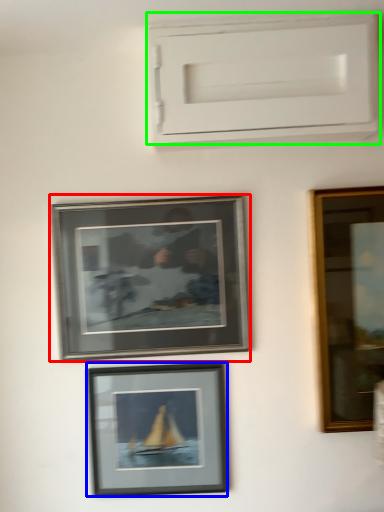
Question: Considering the real-world distances, which object is closest to picture frame (highlighted by a red box)? picture frame (highlighted by a blue box) or window frame (highlighted by a green box).

Choices:
 (A) picture frame
 (B) window frame

Answer: (A)